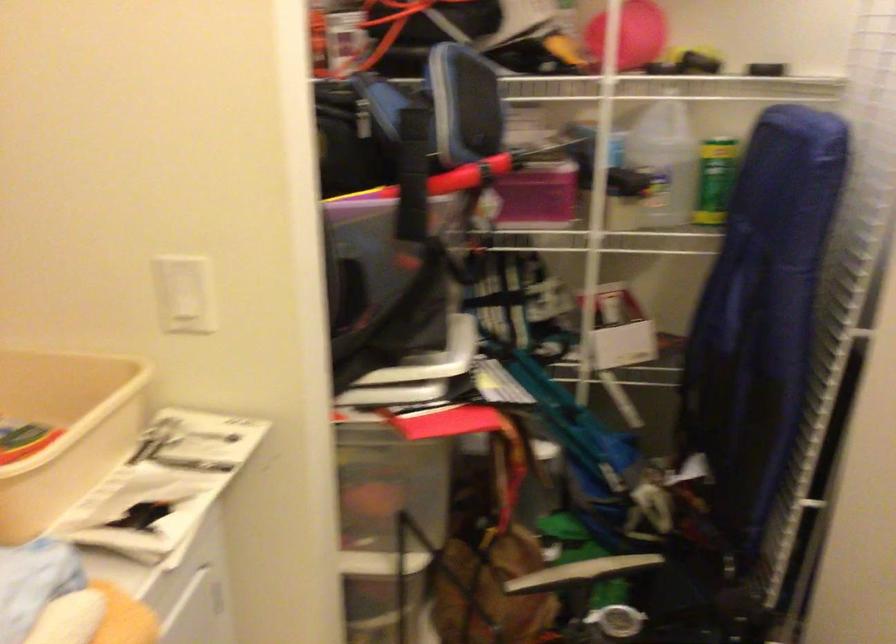
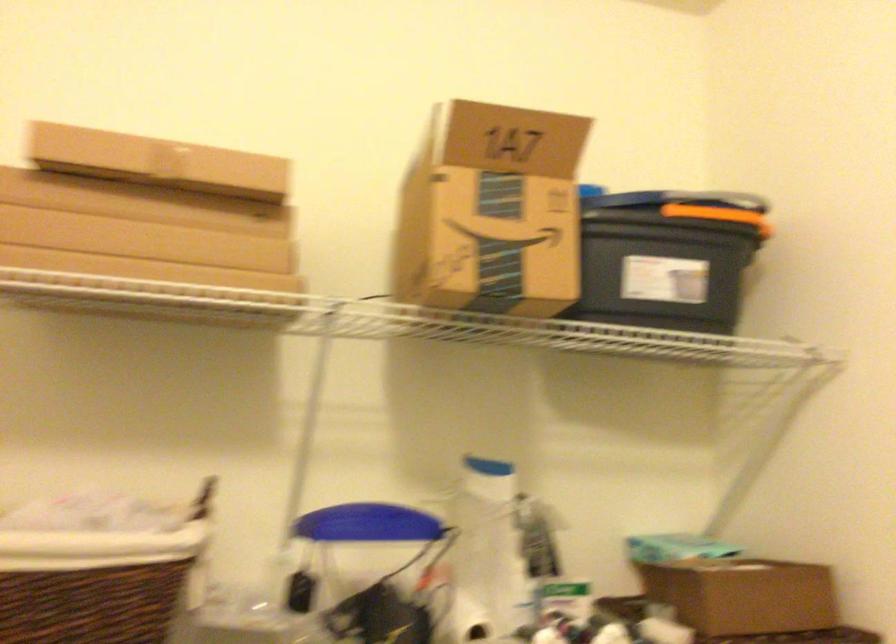
First-person continuous shooting, in which direction is the camera rotating?

The camera rotated toward left-up.